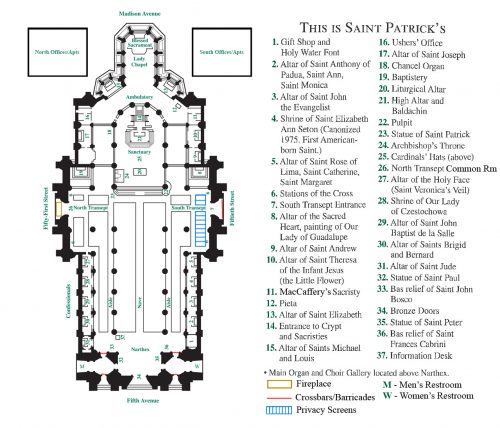
Identify the location of entrances. (65, 208).